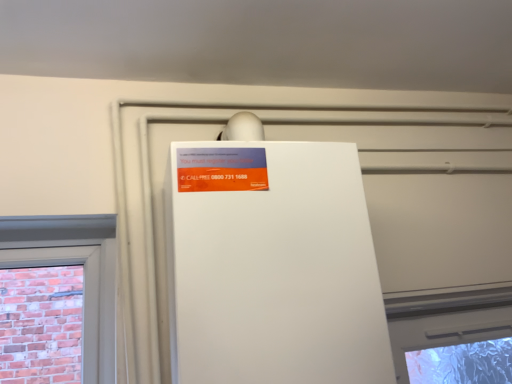
Question: From the image's perspective, relative to white matte refrigerator at center, is orange matte sign at upper center above or below?

Choices:
 (A) below
 (B) above

Answer: (B)

Question: Considering the positions of point 245,160 and point 293,241, is point 245,160 closer or farther from the camera than point 293,241?

Choices:
 (A) closer
 (B) farther

Answer: (B)

Question: Looking at their shapes, would you say orange matte sign at upper center is wider or thinner than white matte refrigerator at center?

Choices:
 (A) wide
 (B) thin

Answer: (B)

Question: Is white matte refrigerator at center inside or outside of orange matte sign at upper center?

Choices:
 (A) inside
 (B) outside

Answer: (B)

Question: Is white matte refrigerator at center taller or shorter than orange matte sign at upper center?

Choices:
 (A) tall
 (B) short

Answer: (A)

Question: Is white matte refrigerator at center in front of or behind orange matte sign at upper center in the image?

Choices:
 (A) behind
 (B) front

Answer: (B)

Question: Considering the relative positions of white matte refrigerator at center and orange matte sign at upper center in the image provided, is white matte refrigerator at center to the left or to the right of orange matte sign at upper center?

Choices:
 (A) right
 (B) left

Answer: (A)